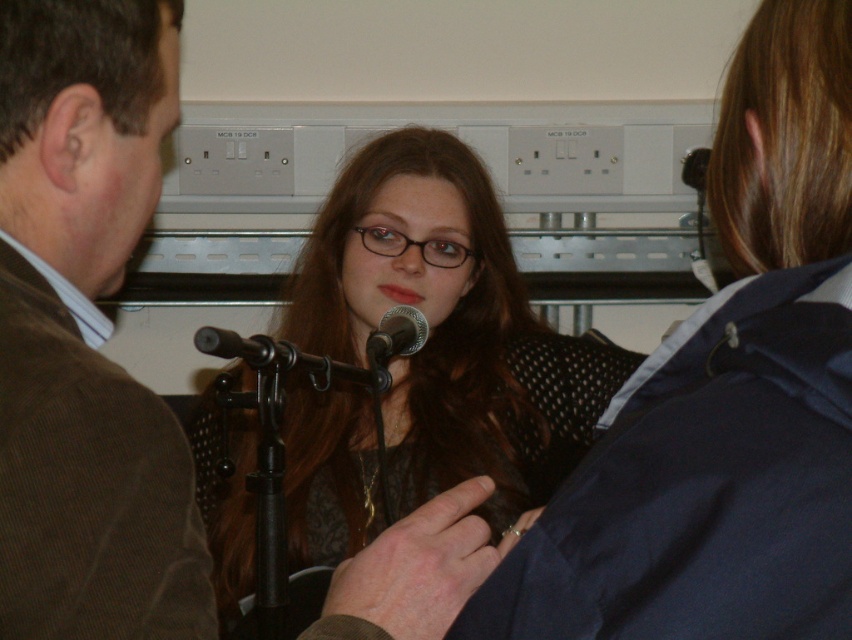
You are a photographer setting up for a group photo. You need to place a matte black microphone at center so that it is equidistant from all three people in the scene. Is the current position of the matte black microphone at center at point (403, 358) suitable for this requirement?

The matte black microphone at center is located at point (403, 358). However, since the three people are positioned differently in the scene, the microphone cannot be equidistant from all three unless their positions form a specific geometric arrangement which isn not confirmed here. The question cannot be definitively answered with the given information.

You are a photographer positioned in front of the black metallic microphone at center. You want to capture a photo of the central woman speaker without the microphone appearing in the frame. Is the microphone close enough to the viewer that you can move your camera slightly to the side to avoid it while still framing the woman?

The black metallic microphone at center is 82.78 centimeters away from the viewer. Since this distance allows for lateral movement without losing focus on the woman, moving the camera slightly to the side should avoid the microphone while keeping her in frame.

You are a sound technician setting up for an event. You have two microphones in front of you, the black metallic microphone at center and the metallic silver microphone at center. Based on the scene description, which microphone should you choose if you need one that is wider?

The black metallic microphone at center might be wider than metallic silver microphone at center, so you should choose the black metallic microphone at center.